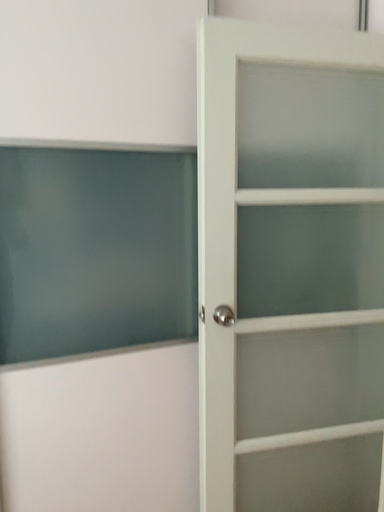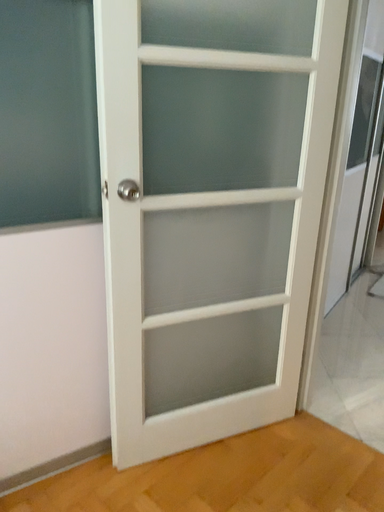
Question: Which way did the camera rotate in the video?

Choices:
 (A) rotated right
 (B) rotated left

Answer: (A)